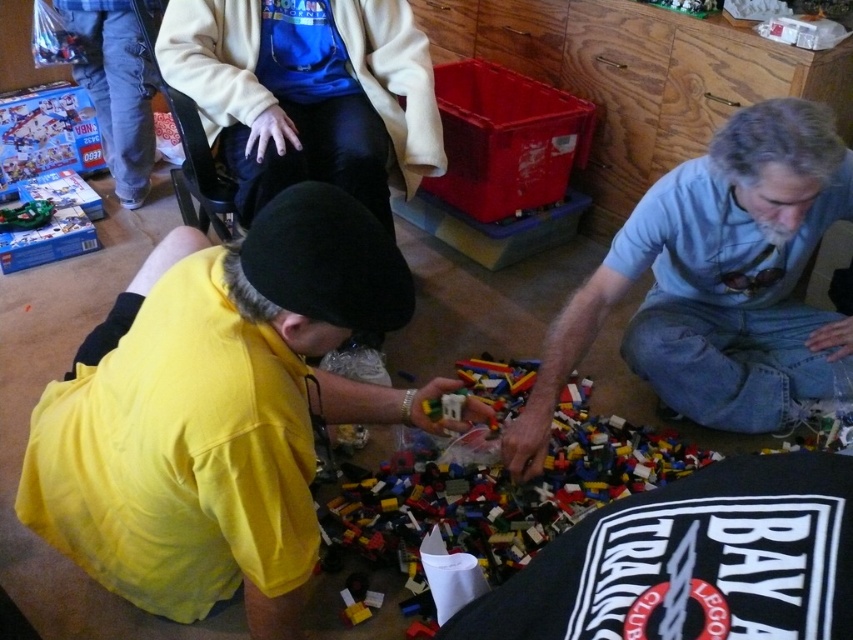
Question: Does black fabric shirt at lower right appear over multicolored plastic bricks at center?

Choices:
 (A) yes
 (B) no

Answer: (A)

Question: Which is nearer to the yellow matte shirt at lower left?

Choices:
 (A) black fabric shirt at lower right
 (B) multicolored plastic bricks at center
 (C) gray hair man at lower right

Answer: (B)

Question: Which point is closer to the camera?

Choices:
 (A) multicolored plastic bricks at center
 (B) yellow matte shirt at lower left
 (C) gray hair man at lower right
 (D) black fabric shirt at lower right

Answer: (D)

Question: Which of these objects is positioned closest to the multicolored plastic bricks at center?

Choices:
 (A) black fabric shirt at lower right
 (B) gray hair man at lower right

Answer: (B)

Question: Does black fabric shirt at lower right appear on the right side of multicolored plastic bricks at center?

Choices:
 (A) no
 (B) yes

Answer: (B)

Question: Where is yellow matte shirt at lower left located in relation to multicolored plastic bricks at center in the image?

Choices:
 (A) above
 (B) below

Answer: (A)